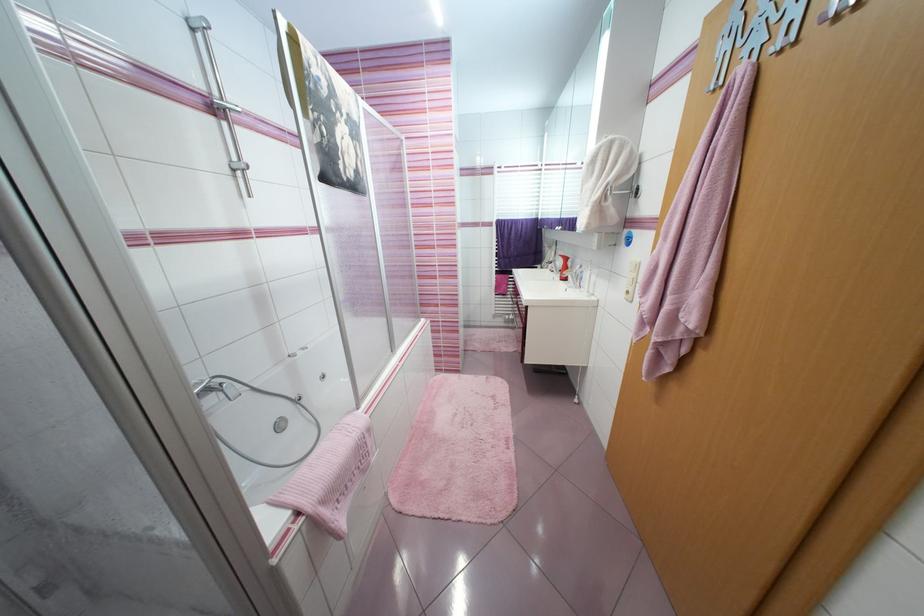
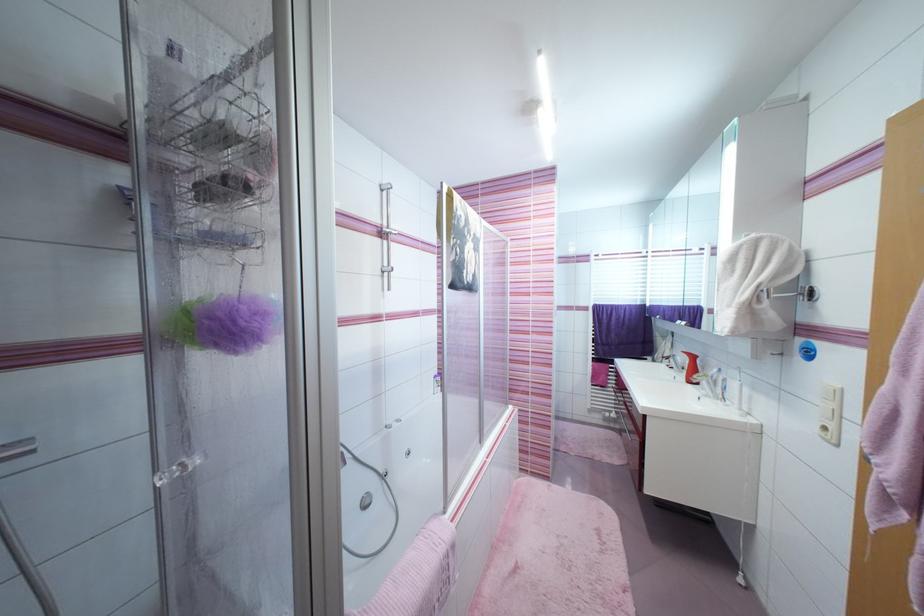
In the second image, find the point that corresponds to [217,120] in the first image.

(383, 241)